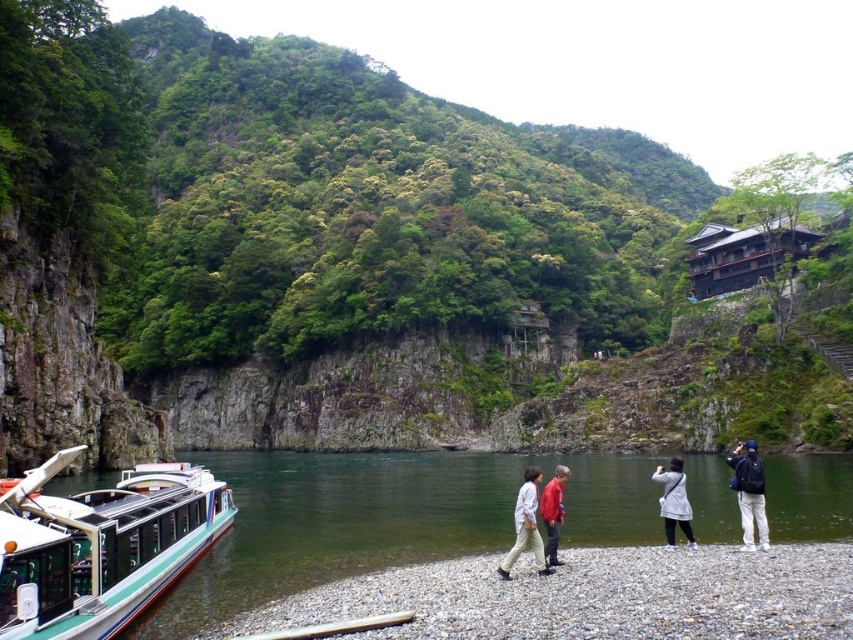
Between green smooth water at lower center and gray gravel shoreline at lower center, which one appears on the right side from the viewer's perspective?

gray gravel shoreline at lower center is more to the right.

Is green smooth water at lower center bigger than gray gravel shoreline at lower center?

Indeed, green smooth water at lower center has a larger size compared to gray gravel shoreline at lower center.

Is point (840, 532) farther from camera compared to point (717, 547)?

That is True.

Where is `green smooth water at lower center`? The height and width of the screenshot is (640, 853). green smooth water at lower center is located at coordinates (350, 516).

Who is lower down, green smooth water at lower center or green and white plastic boat at lower left?

green smooth water at lower center is below.

Is green smooth water at lower center bigger than green and white plastic boat at lower left?

Indeed, green smooth water at lower center has a larger size compared to green and white plastic boat at lower left.

Which is in front, point (219, 563) or point (33, 632)?

Point (33, 632) is more forward.

The width and height of the screenshot is (853, 640). I want to click on green smooth water at lower center, so click(350, 516).

Does green smooth water at lower center have a greater width compared to light beige pants at center?

Yes.

Where is `green smooth water at lower center`? green smooth water at lower center is located at coordinates (350, 516).

Is point (421, 490) positioned before point (531, 509)?

No, (421, 490) is behind (531, 509).

At what (x,y) coordinates should I click in order to perform the action: click on green smooth water at lower center. Please return your answer as a coordinate pair (x, y). Image resolution: width=853 pixels, height=640 pixels. Looking at the image, I should click on (350, 516).